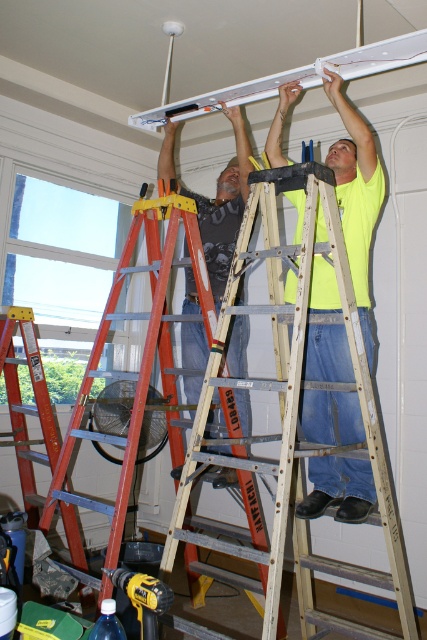
Looking at this image, based on the scene description, where is the wooden ladder at center located in terms of coordinates?

The wooden ladder at center is located at point coordinates of (295, 424).